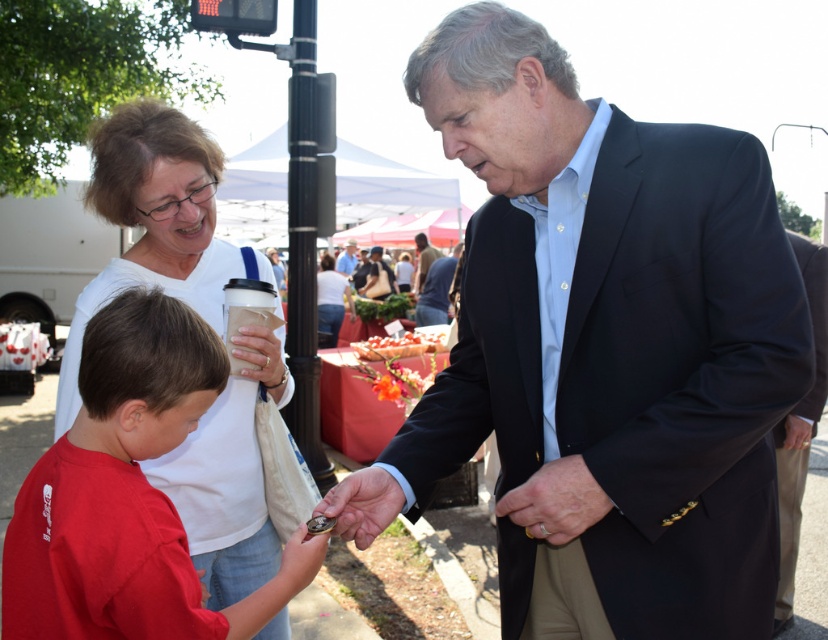
Question: Does matte black suit at center appear on the right side of smooth leather hand at center?

Choices:
 (A) yes
 (B) no

Answer: (A)

Question: Which point is closer to the camera?

Choices:
 (A) white matte shirt at upper left
 (B) smooth leather hand at center
 (C) dark suit jacket at center
 (D) light blue shirt at center

Answer: (B)

Question: Based on their relative distances, which object is nearer to the matte black suit at center?

Choices:
 (A) smooth leather hand at center
 (B) white matte shirt at upper left

Answer: (A)

Question: Can you confirm if white matte shirt at upper left is positioned to the right of light blue shirt at center?

Choices:
 (A) no
 (B) yes

Answer: (B)

Question: Which point is farther to the camera?

Choices:
 (A) light blue shirt at center
 (B) white matte shirt at upper left
 (C) smooth leather hand at center

Answer: (A)

Question: Does dark suit jacket at center come in front of light blue shirt at center?

Choices:
 (A) no
 (B) yes

Answer: (B)